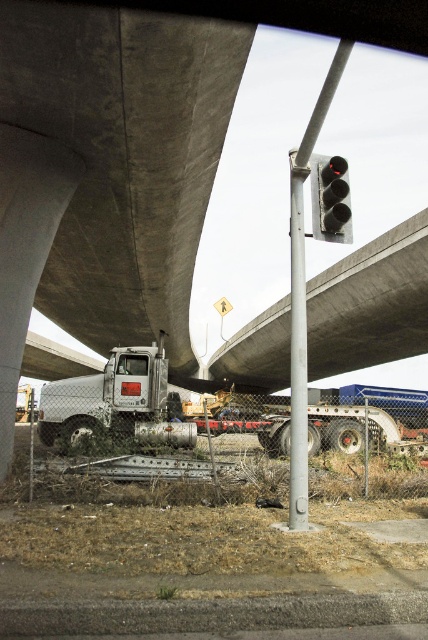
Question: Which object appears closest to the camera in this image?

Choices:
 (A) silver metallic trailer truck at center
 (B) silver metallic pole at center
 (C) concrete at upper center
 (D) silver metallic truck at center

Answer: (B)

Question: Which object is farther from the camera taking this photo?

Choices:
 (A) silver metallic truck at center
 (B) concrete at upper center
 (C) silver metallic pole at center
 (D) black matte traffic light at upper center

Answer: (B)

Question: Which object is the closest to the silver metallic trailer truck at center?

Choices:
 (A) metallic gray traffic light pole at center
 (B) concrete at upper center
 (C) silver metallic pole at center

Answer: (A)

Question: Can you confirm if silver metallic truck at center is thinner than silver metallic trailer truck at center?

Choices:
 (A) no
 (B) yes

Answer: (A)

Question: Is metallic gray traffic light pole at center thinner than black matte traffic light at upper center?

Choices:
 (A) yes
 (B) no

Answer: (B)

Question: Is concrete at upper center positioned at the back of silver metallic trailer truck at center?

Choices:
 (A) yes
 (B) no

Answer: (A)